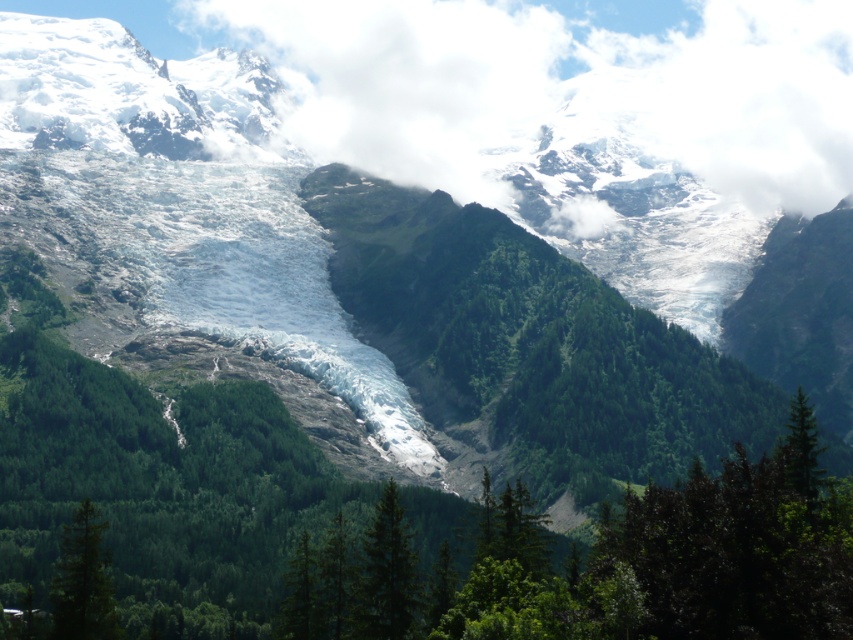
Between point (397, 609) and point (77, 609), which one is positioned in front?

Point (397, 609) is more forward.

Who is more distant from viewer, (361, 580) or (103, 600)?

Positioned behind is point (103, 600).

Find the location of `green matte tree at lower center`. green matte tree at lower center is located at coordinates (x=387, y=573).

Looking at this image, is the position of white fluffy cloud at upper center more distant than that of green matte tree at lower left?

Yes, it is.

Does white fluffy cloud at upper center have a lesser width compared to green matte tree at lower left?

Incorrect, white fluffy cloud at upper center's width is not less than green matte tree at lower left's.

Is point (805, 196) positioned after point (74, 582)?

Yes, it is behind point (74, 582).

At what (x,y) coordinates should I click in order to perform the action: click on white fluffy cloud at upper center. Please return your answer as a coordinate pair (x, y). Looking at the image, I should click on (563, 90).

Consider the image. Is white fluffy cloud at upper center positioned at the back of green matte tree at lower center?

Yes.

You are a GUI agent. You are given a task and a screenshot of the screen. Output one action in this format:
    pyautogui.click(x=<x>, y=<y>)
    Task: Click on the white fluffy cloud at upper center
    The image size is (853, 640).
    Given the screenshot: What is the action you would take?
    pyautogui.click(x=563, y=90)

At what (x,y) coordinates should I click in order to perform the action: click on white fluffy cloud at upper center. Please return your answer as a coordinate pair (x, y). The image size is (853, 640). Looking at the image, I should click on (563, 90).